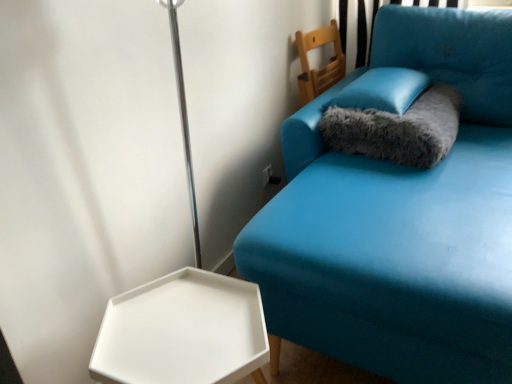
What do you see at coordinates (400, 216) in the screenshot?
I see `teal fabric couch at upper right` at bounding box center [400, 216].

Image resolution: width=512 pixels, height=384 pixels. I want to click on fuzzy gray cat bed at upper right, so click(398, 129).

From the image's perspective, which one is positioned lower, white matte hexagonal tray at lower left or satin blue pillow at upper right?

white matte hexagonal tray at lower left.

Is white matte hexagonal tray at lower left bigger or smaller than satin blue pillow at upper right?

white matte hexagonal tray at lower left is bigger than satin blue pillow at upper right.

Does white matte hexagonal tray at lower left turn towards satin blue pillow at upper right?

No, white matte hexagonal tray at lower left is not turned towards satin blue pillow at upper right.

Is teal fabric couch at upper right taller than white matte hexagonal tray at lower left?

Indeed, teal fabric couch at upper right has a greater height compared to white matte hexagonal tray at lower left.

Does teal fabric couch at upper right appear on the right side of white matte hexagonal tray at lower left?

Correct, you'll find teal fabric couch at upper right to the right of white matte hexagonal tray at lower left.

From the image's perspective, which is above, teal fabric couch at upper right or white matte hexagonal tray at lower left?

teal fabric couch at upper right appears higher in the image.

From a real-world perspective, who is located lower, teal fabric couch at upper right or white matte hexagonal tray at lower left?

white matte hexagonal tray at lower left.

Considering the relative positions of teal fabric couch at upper right and wooden chair at upper center in the image provided, is teal fabric couch at upper right to the right of wooden chair at upper center from the viewer's perspective?

Yes, teal fabric couch at upper right is to the right of wooden chair at upper center.

Does teal fabric couch at upper right turn towards wooden chair at upper center?

No, teal fabric couch at upper right is not facing towards wooden chair at upper center.

In terms of height, does teal fabric couch at upper right look taller or shorter compared to wooden chair at upper center?

Considering their sizes, teal fabric couch at upper right has more height than wooden chair at upper center.

Looking at this image, from a real-world perspective, who is located higher, teal fabric couch at upper right or wooden chair at upper center?

wooden chair at upper center, from a real-world perspective.

Is fuzzy gray cat bed at upper right not close to white matte hexagonal tray at lower left?

That's not correct — fuzzy gray cat bed at upper right is a little close to white matte hexagonal tray at lower left.

Does fuzzy gray cat bed at upper right come behind white matte hexagonal tray at lower left?

Yes, fuzzy gray cat bed at upper right is further from the camera.

Considering the points (440, 153) and (119, 361), which point is in front, point (440, 153) or point (119, 361)?

Positioned in front is point (119, 361).

Considering the positions of objects fuzzy gray cat bed at upper right and white matte hexagonal tray at lower left in the image provided, who is more to the right, fuzzy gray cat bed at upper right or white matte hexagonal tray at lower left?

fuzzy gray cat bed at upper right.

Is fuzzy gray cat bed at upper right closer to the viewer compared to wooden chair at upper center?

Yes, the depth of fuzzy gray cat bed at upper right is less than that of wooden chair at upper center.

Where is `cat bed located on the right of wooden chair at upper center`? cat bed located on the right of wooden chair at upper center is located at coordinates (398, 129).

From a real-world perspective, which is physically above, fuzzy gray cat bed at upper right or wooden chair at upper center?

wooden chair at upper center is physically above.

Does point (429, 142) lie behind point (340, 63)?

No, it is not.

From the picture: Is teal fabric couch at upper right far away from satin blue pillow at upper right?

That's not correct — teal fabric couch at upper right is a little close to satin blue pillow at upper right.

Who is smaller, teal fabric couch at upper right or satin blue pillow at upper right?

satin blue pillow at upper right is smaller.

Which is closer, (509, 378) or (383, 104)?

Point (509, 378) is closer to the camera than point (383, 104).

From a real-world perspective, relative to white matte hexagonal tray at lower left, is wooden chair at upper center vertically above or below?

Clearly, from a real-world perspective, wooden chair at upper center is above white matte hexagonal tray at lower left.

This screenshot has height=384, width=512. Find the location of `table on the left of wooden chair at upper center`. table on the left of wooden chair at upper center is located at coordinates (183, 332).

From the image's perspective, which is above, wooden chair at upper center or white matte hexagonal tray at lower left?

From the image's view, wooden chair at upper center is above.

How many degrees apart are the facing directions of wooden chair at upper center and white matte hexagonal tray at lower left?

5.08 degrees separate the facing orientations of wooden chair at upper center and white matte hexagonal tray at lower left.

Find the location of a particular element. This screenshot has height=384, width=512. table below the satin blue pillow at upper right (from a real-world perspective) is located at coordinates (183, 332).

At what (x,y) coordinates should I click in order to perform the action: click on studio couch above the white matte hexagonal tray at lower left (from a real-world perspective). Please return your answer as a coordinate pair (x, y). Looking at the image, I should click on (400, 216).

Consider the image. Considering their positions, is satin blue pillow at upper right positioned closer to teal fabric couch at upper right than wooden chair at upper center?

The object closer to teal fabric couch at upper right is satin blue pillow at upper right.

From the image, which object appears to be farther from white matte hexagonal tray at lower left, fuzzy gray cat bed at upper right or wooden chair at upper center?

Among the two, wooden chair at upper center is located further to white matte hexagonal tray at lower left.

Looking at the image, which one is located further to white matte hexagonal tray at lower left, satin blue pillow at upper right or teal fabric couch at upper right?

satin blue pillow at upper right lies further to white matte hexagonal tray at lower left than the other object.

Estimate the real-world distances between objects in this image. Which object is closer to wooden chair at upper center, fuzzy gray cat bed at upper right or teal fabric couch at upper right?

Based on the image, fuzzy gray cat bed at upper right appears to be nearer to wooden chair at upper center.

Based on their spatial positions, is teal fabric couch at upper right or white matte hexagonal tray at lower left further from fuzzy gray cat bed at upper right?

Based on the image, white matte hexagonal tray at lower left appears to be further to fuzzy gray cat bed at upper right.

Based on their spatial positions, is fuzzy gray cat bed at upper right or white matte hexagonal tray at lower left closer to wooden chair at upper center?

Based on the image, fuzzy gray cat bed at upper right appears to be nearer to wooden chair at upper center.

Estimate the real-world distances between objects in this image. Which object is closer to satin blue pillow at upper right, wooden chair at upper center or fuzzy gray cat bed at upper right?

fuzzy gray cat bed at upper right is closer to satin blue pillow at upper right.

Which object lies further to the anchor point teal fabric couch at upper right, white matte hexagonal tray at lower left or satin blue pillow at upper right?

Based on the image, white matte hexagonal tray at lower left appears to be further to teal fabric couch at upper right.

This screenshot has width=512, height=384. I want to click on pillow positioned between fuzzy gray cat bed at upper right and wooden chair at upper center from near to far, so click(x=383, y=90).

Locate an element on the screen. The width and height of the screenshot is (512, 384). pillow between wooden chair at upper center and white matte hexagonal tray at lower left in the up-down direction is located at coordinates (383, 90).

Image resolution: width=512 pixels, height=384 pixels. I want to click on cat bed between satin blue pillow at upper right and white matte hexagonal tray at lower left from top to bottom, so click(398, 129).

At what (x,y) coordinates should I click in order to perform the action: click on table between teal fabric couch at upper right and satin blue pillow at upper right in the front-back direction. Please return your answer as a coordinate pair (x, y). The image size is (512, 384). Looking at the image, I should click on (183, 332).